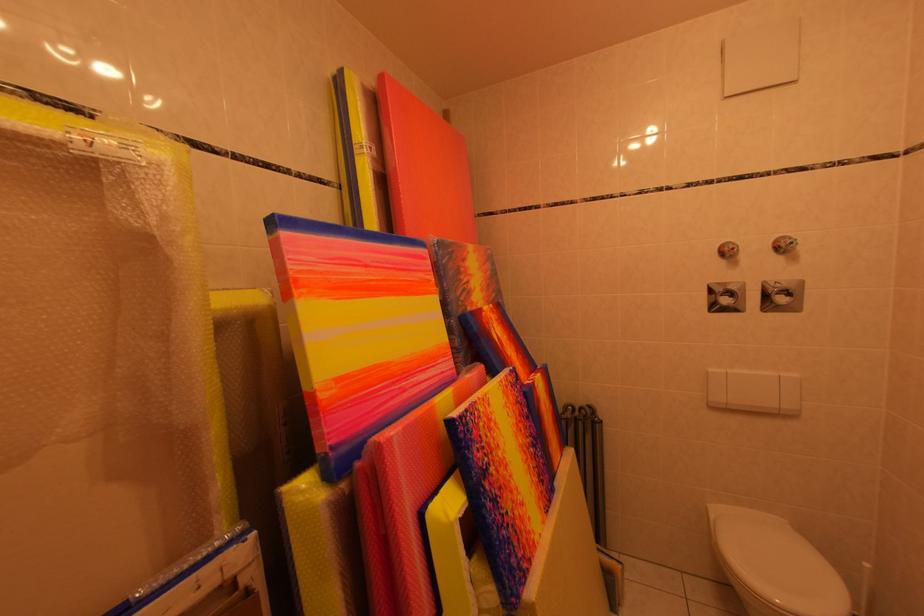
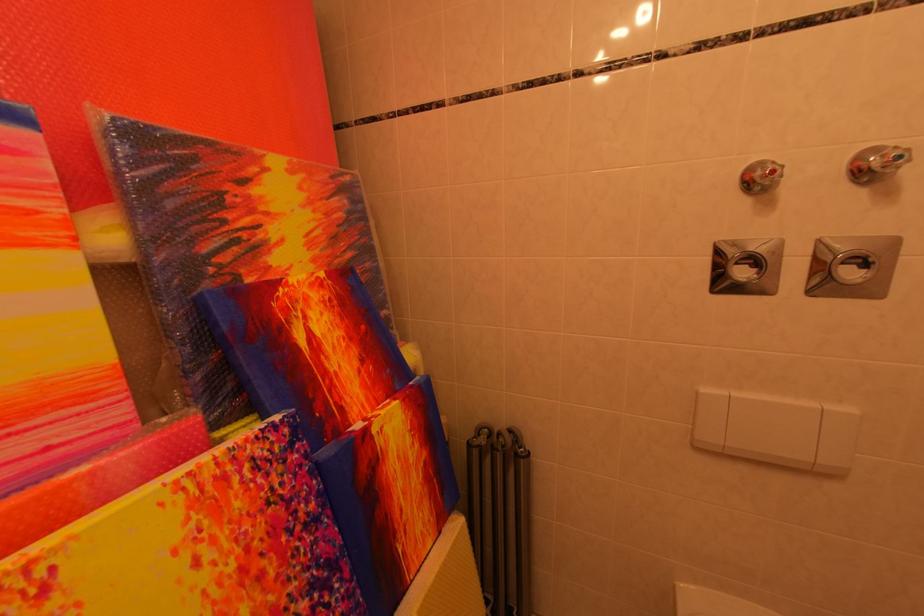
Find the pixel in the second image that matches pixel 742 253 in the first image.

(782, 176)